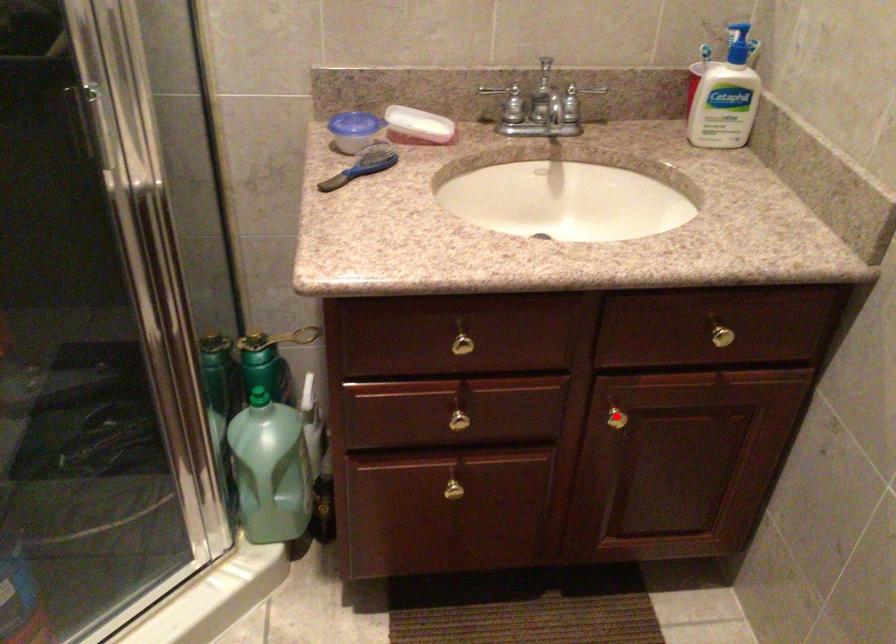
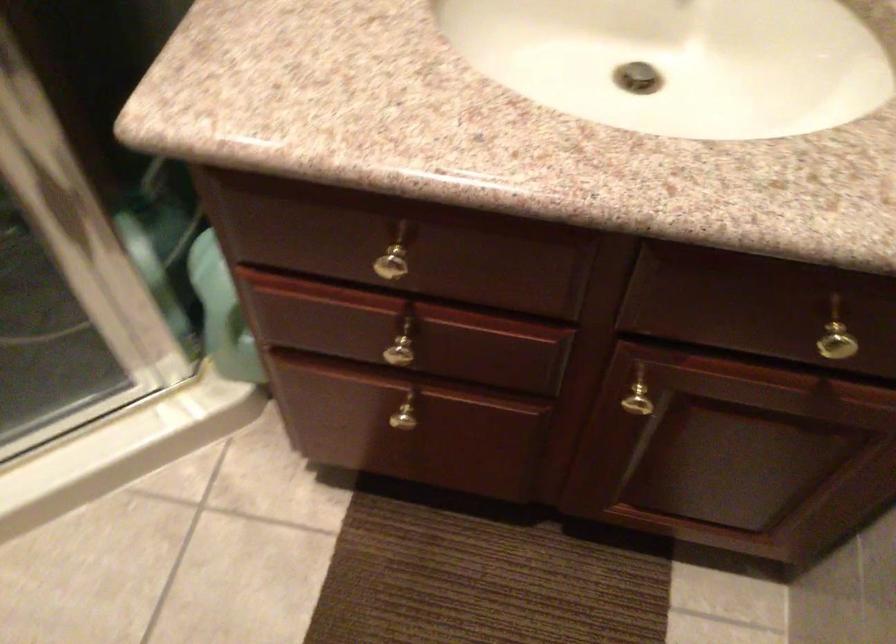
Question: A red point is marked in image1. In image2, is the corresponding 3D point closer to the camera or farther? Reply with the corresponding letter.

Choices:
 (A) The corresponding 3D point is closer.
 (B) The corresponding 3D point is farther.

Answer: (A)